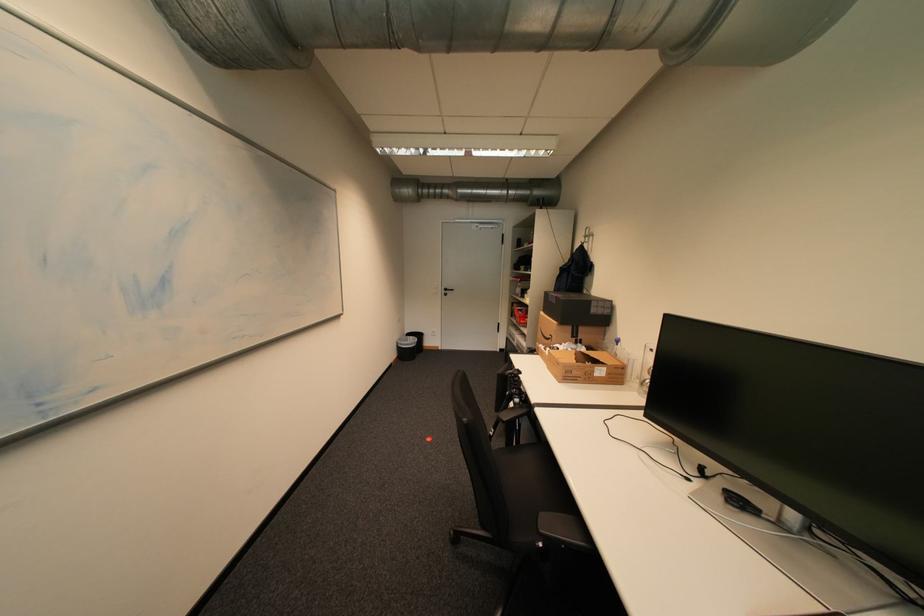
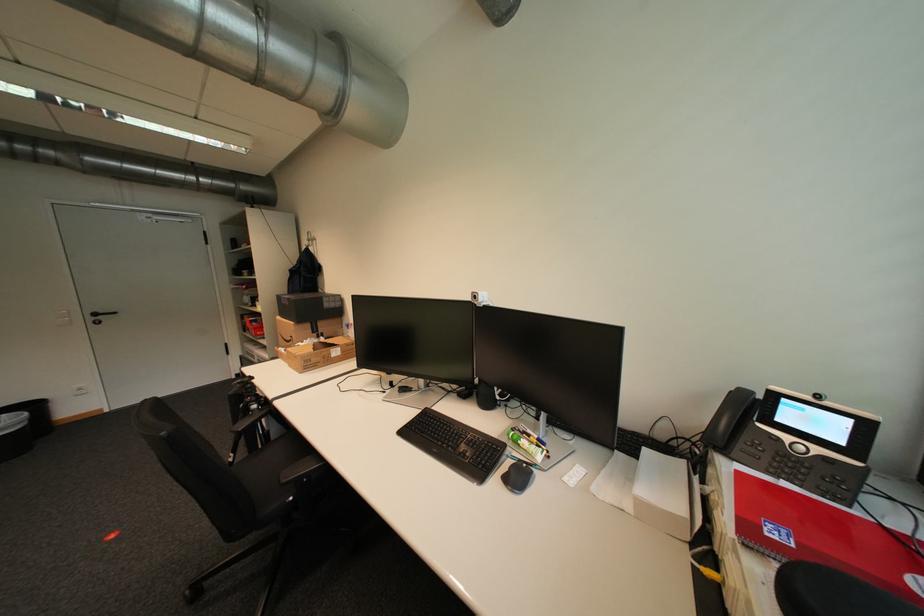
Locate, in the second image, the point that corresponds to point 558,336 in the first image.

(299, 338)